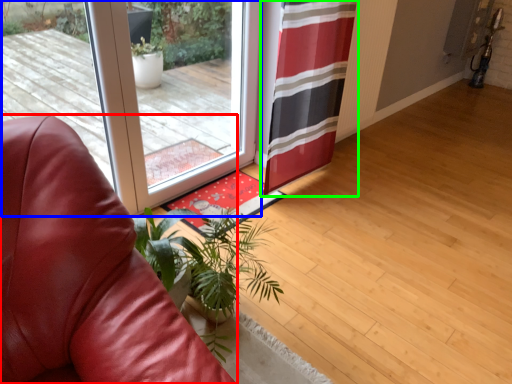
Question: Considering the real-world distances, which object is farthest from chair (highlighted by a red box)? door (highlighted by a blue box) or curtain (highlighted by a green box)?

Choices:
 (A) door
 (B) curtain

Answer: (B)